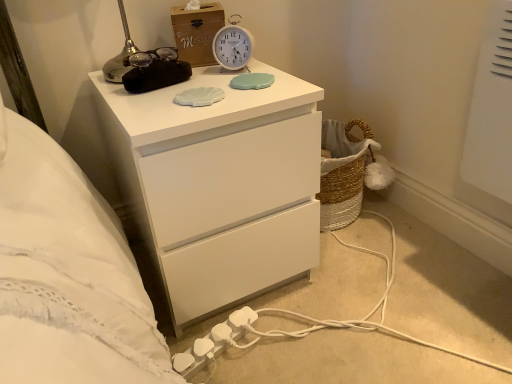
Where is `empty space that is ontop of white plastic power strip at lower center (from a real-world perspective)`? The height and width of the screenshot is (384, 512). empty space that is ontop of white plastic power strip at lower center (from a real-world perspective) is located at coordinates (346, 312).